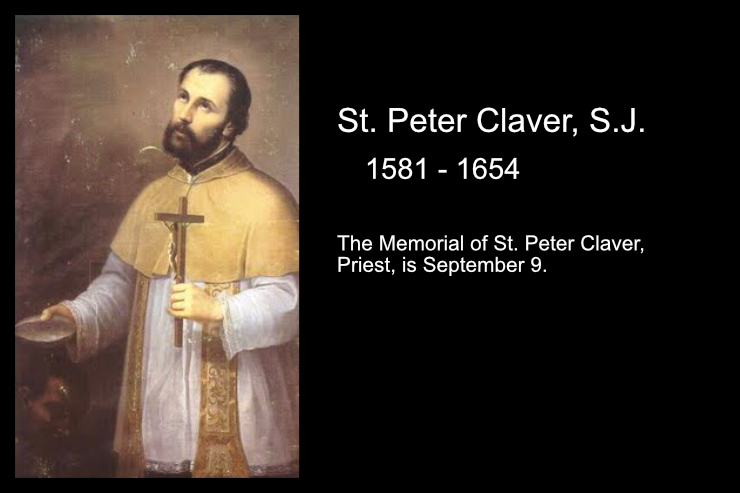
Point to any painting of st. peter claver in the image. Your answer should be formatted as a list of tuples, i.e. [(x1, y1), (x2, y2), ...], where each tuple contains the x and y coordinates of a point satisfying the conditions above.

[(246, 207)]